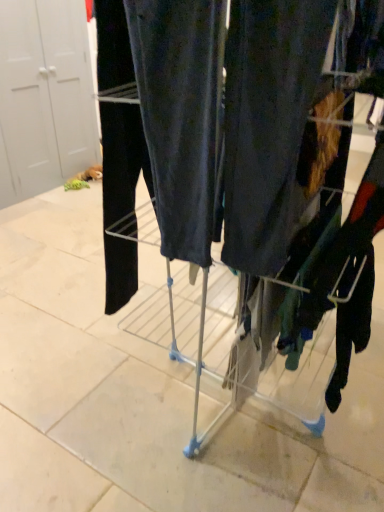
Question: Based on their sizes in the image, would you say metallic silver trolley at center is bigger or smaller than white matte door at left?

Choices:
 (A) big
 (B) small

Answer: (B)

Question: Considering their positions, is metallic silver trolley at center located in front of or behind white matte door at left?

Choices:
 (A) front
 (B) behind

Answer: (A)

Question: Is metallic silver trolley at center taller or shorter than white matte door at left?

Choices:
 (A) short
 (B) tall

Answer: (A)

Question: From the image's perspective, is white matte door at left positioned above or below metallic silver trolley at center?

Choices:
 (A) above
 (B) below

Answer: (A)

Question: Based on their sizes in the image, would you say white matte door at left is bigger or smaller than metallic silver trolley at center?

Choices:
 (A) small
 (B) big

Answer: (B)

Question: From a real-world perspective, relative to metallic silver trolley at center, is white matte door at left vertically above or below?

Choices:
 (A) below
 (B) above

Answer: (B)

Question: Do you think white matte door at left is within metallic silver trolley at center, or outside of it?

Choices:
 (A) inside
 (B) outside

Answer: (B)